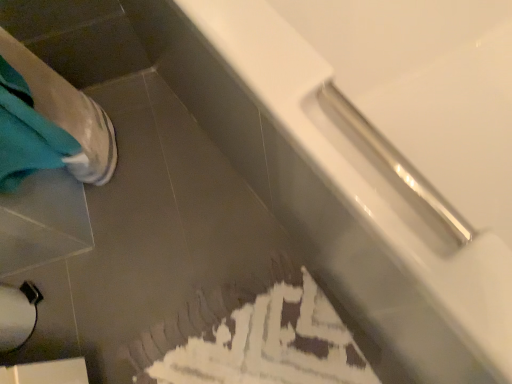
Question: Is white glossy bathtub at upper right not inside white matte toilet paper at lower left?

Choices:
 (A) yes
 (B) no

Answer: (A)

Question: Is white glossy bathtub at upper right at the left side of white matte toilet paper at lower left?

Choices:
 (A) no
 (B) yes

Answer: (A)

Question: Is white glossy bathtub at upper right positioned far away from white matte toilet paper at lower left?

Choices:
 (A) no
 (B) yes

Answer: (A)

Question: Can you confirm if white glossy bathtub at upper right is shorter than white matte toilet paper at lower left?

Choices:
 (A) yes
 (B) no

Answer: (B)

Question: Can you confirm if white glossy bathtub at upper right is wider than white matte toilet paper at lower left?

Choices:
 (A) no
 (B) yes

Answer: (B)

Question: Does white glossy bathtub at upper right lie in front of white matte toilet paper at lower left?

Choices:
 (A) yes
 (B) no

Answer: (A)

Question: Is white matte toilet paper at lower left positioned before white glossy bathtub at upper right?

Choices:
 (A) no
 (B) yes

Answer: (A)

Question: Is white matte toilet paper at lower left next to white glossy bathtub at upper right and touching it?

Choices:
 (A) no
 (B) yes

Answer: (A)

Question: Does white matte toilet paper at lower left appear on the right side of white glossy bathtub at upper right?

Choices:
 (A) yes
 (B) no

Answer: (B)

Question: Does white matte toilet paper at lower left appear on the left side of white glossy bathtub at upper right?

Choices:
 (A) no
 (B) yes

Answer: (B)

Question: Does white matte toilet paper at lower left have a smaller size compared to white glossy bathtub at upper right?

Choices:
 (A) no
 (B) yes

Answer: (B)

Question: Is white matte toilet paper at lower left further to the viewer compared to white glossy bathtub at upper right?

Choices:
 (A) yes
 (B) no

Answer: (A)

Question: Do you think white matte toilet paper at lower left is within white glossy bathtub at upper right, or outside of it?

Choices:
 (A) outside
 (B) inside

Answer: (A)